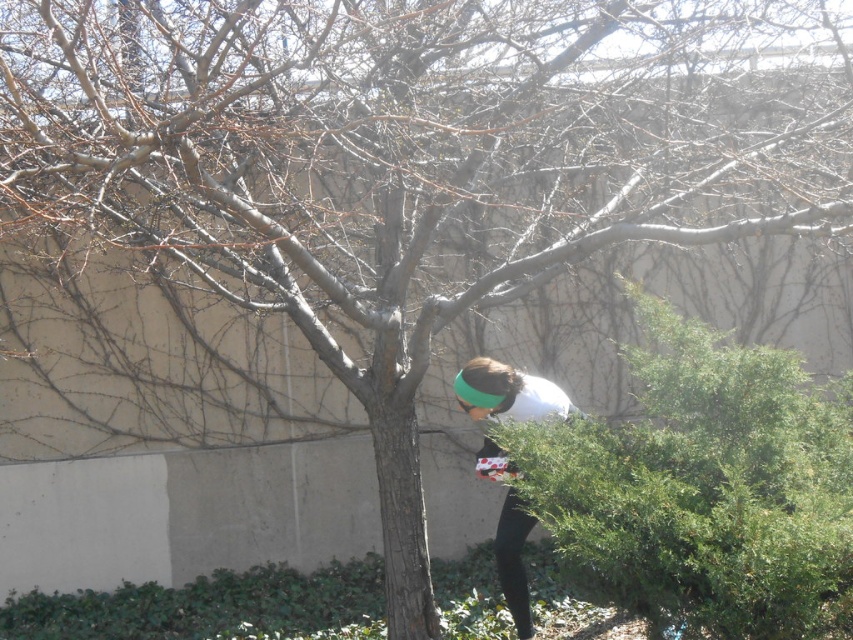
Is point (479, 390) positioned before point (502, 513)?

Yes.

Between white fabric at center and black matte leggings at lower center, which one appears on the right side from the viewer's perspective?

From the viewer's perspective, white fabric at center appears more on the right side.

This screenshot has width=853, height=640. What do you see at coordinates (508, 392) in the screenshot?
I see `white fabric at center` at bounding box center [508, 392].

You are a GUI agent. You are given a task and a screenshot of the screen. Output one action in this format:
    pyautogui.click(x=<x>, y=<y>)
    Task: Click on the white fabric at center
    This screenshot has width=853, height=640.
    Given the screenshot: What is the action you would take?
    pyautogui.click(x=508, y=392)

Does green leafy hedge at lower right appear under white fabric at center?

Incorrect, green leafy hedge at lower right is not positioned below white fabric at center.

Does point (729, 374) come in front of point (508, 536)?

Yes.

Which is in front, point (706, 340) or point (476, 372)?

Positioned in front is point (706, 340).

Where is `green leafy hedge at lower right`? The image size is (853, 640). green leafy hedge at lower right is located at coordinates (704, 486).

This screenshot has height=640, width=853. In order to click on green leafy hedge at lower right in this screenshot , I will do `click(704, 486)`.

Who is taller, green leafy hedge at lower right or black matte leggings at lower center?

green leafy hedge at lower right

At what (x,y) coordinates should I click in order to perform the action: click on green leafy hedge at lower right. Please return your answer as a coordinate pair (x, y). Looking at the image, I should click on (704, 486).